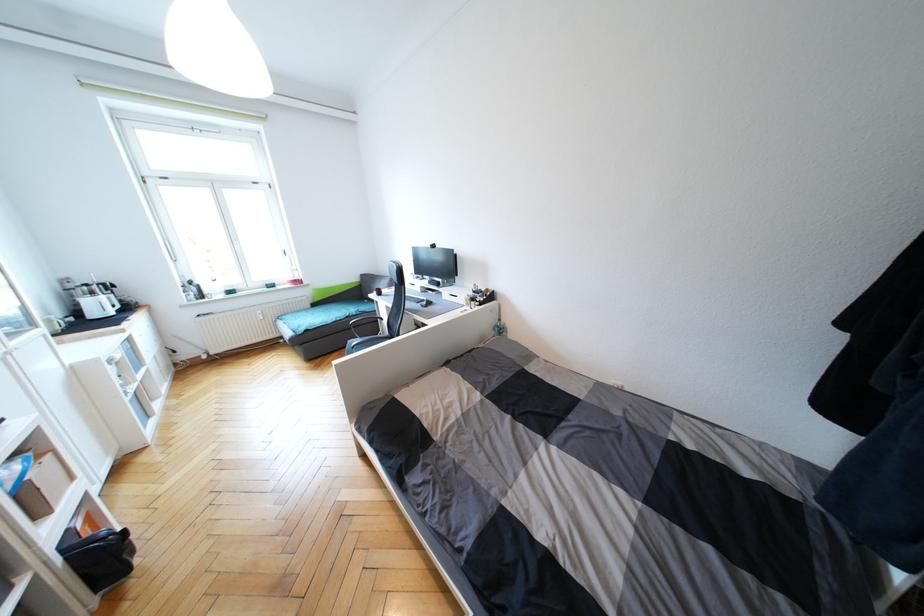
Describe the element at coordinates (323, 314) in the screenshot. The width and height of the screenshot is (924, 616). I see `a sofa sitting surface` at that location.